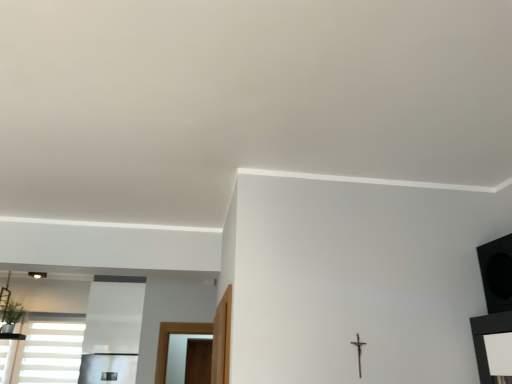
Question: Relative to white matte window at lower left, is green leafy plant at lower left in front or behind?

Choices:
 (A) behind
 (B) front

Answer: (B)

Question: From the image's perspective, is green leafy plant at lower left above or below white matte window at lower left?

Choices:
 (A) below
 (B) above

Answer: (B)

Question: Based on their relative distances, which object is farther from the green leafy plant at lower left?

Choices:
 (A) white matte window at lower left
 (B) metallic crucifix at center-right

Answer: (B)

Question: Considering the real-world distances, which object is closest to the metallic crucifix at center-right?

Choices:
 (A) green leafy plant at lower left
 (B) white matte window at lower left

Answer: (B)